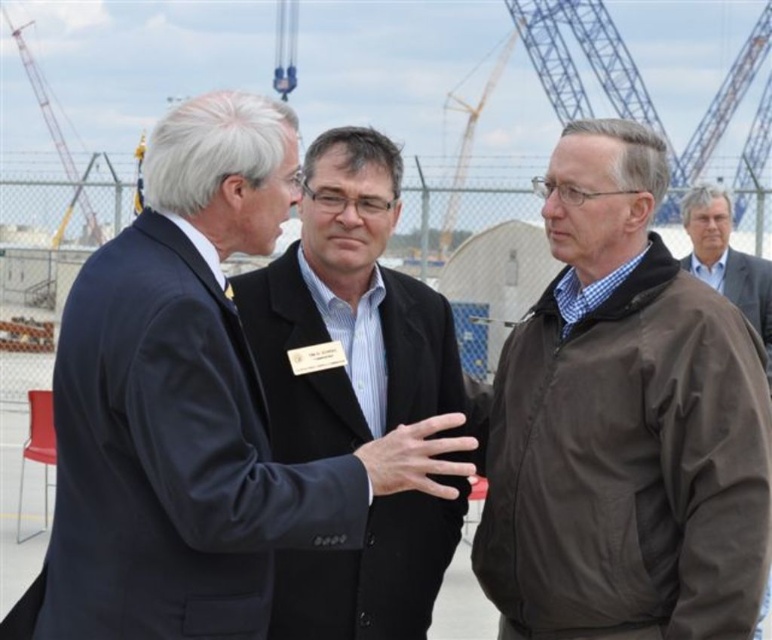
You are a security guard at the construction site. You need to report the position of the dark blue suit at center and the black smooth suit at center. Which one is lower in the image?

The dark blue suit at center is located below the black smooth suit at center, so the dark blue suit at center is lower in the image.

You are a new worker at the construction site and need to locate the supervisor. The supervisor is wearing a dark blue suit and is standing near the crane. Based on the image, is the dark blue suit at center closer to the ground than the metallic gray crane at upper left?

Yes, the dark blue suit at center is shorter than the metallic gray crane at upper left, so the supervisor in the dark blue suit at center is closer to the ground compared to the crane.